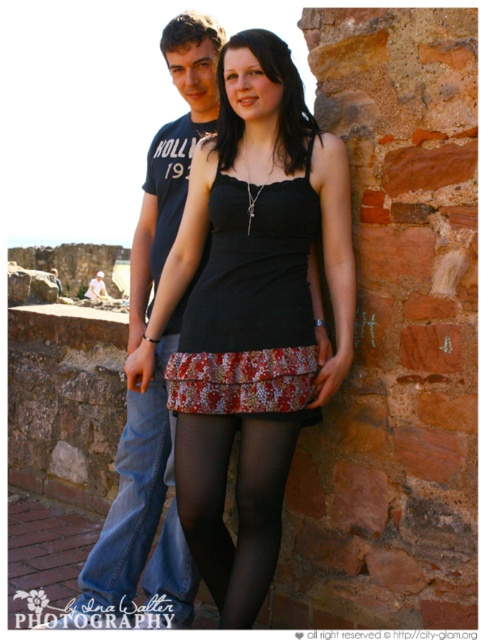
Question: Is black sheer tights at center closer to camera compared to denim jeans at left?

Choices:
 (A) no
 (B) yes

Answer: (B)

Question: Which object is closer to the camera taking this photo?

Choices:
 (A) denim jeans at left
 (B) black satin dress at center

Answer: (B)

Question: Does black satin dress at center have a greater width compared to black sheer tights at center?

Choices:
 (A) no
 (B) yes

Answer: (B)

Question: Which object is positioned farthest from the denim jeans at center?

Choices:
 (A) black sheer tights at center
 (B) denim jeans at left
 (C) floral-patterned fabric dress at center
 (D) black satin dress at center

Answer: (C)

Question: Considering the relative positions of black satin dress at center and floral-patterned fabric dress at center in the image provided, where is black satin dress at center located with respect to floral-patterned fabric dress at center?

Choices:
 (A) right
 (B) left

Answer: (B)

Question: Estimate the real-world distances between objects in this image. Which object is closer to the black satin dress at center?

Choices:
 (A) black sheer tights at center
 (B) denim jeans at left
 (C) denim jeans at center

Answer: (A)